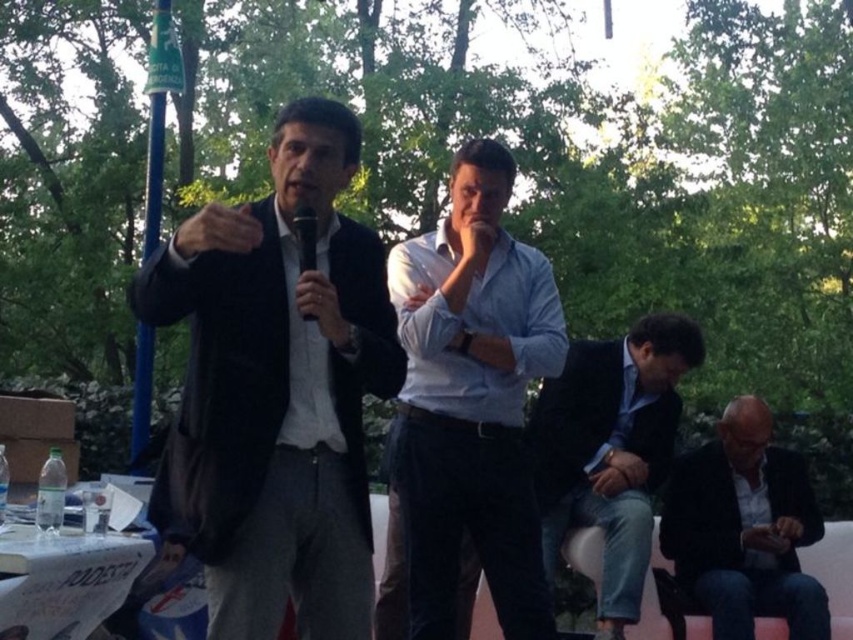
You are organizing a photo shoot and need to ensure that the light blue shirt at center and dark gray suit at lower right are visible in the frame. Given their sizes, which of the two items might require you to adjust the camera angle to ensure both are fully captured?

The light blue shirt at center is larger in size compared to the dark gray suit at lower right, so adjusting the camera angle might be necessary to ensure the larger light blue shirt at center is fully visible while also capturing the smaller dark gray suit at lower right in the frame.

Based on the coordinates provided, which object in the scene is located at point (276, 390)?

The point (276, 390) corresponds to the matte black suit at left.

You are a photographer at the event and need to ensure both the light blue shirt at center and the dark gray suit at lower right are clearly visible in your photo. Given their height difference, where should you position your camera to capture both effectively?

The light blue shirt at center is taller than the dark gray suit at lower right. To capture both effectively, position the camera at a lower angle so the taller light blue shirt at center doesn t block the shorter dark gray suit at lower right.